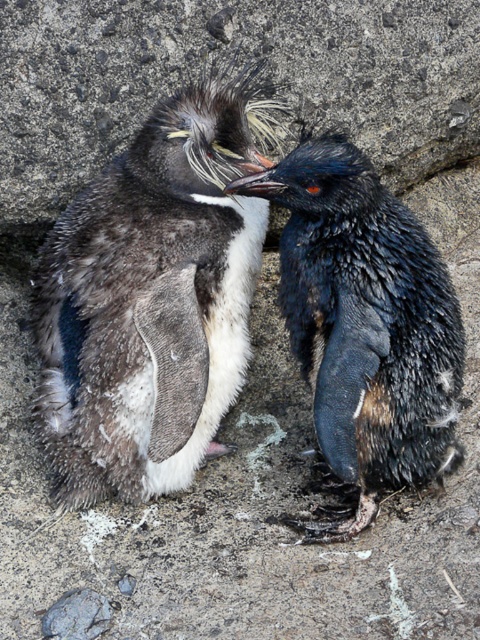
Where is the dark brown fluffy penguin at center located in the image?

The dark brown fluffy penguin at center is located at point (153, 298).

You are a zookeeper who needs to prepare food portions for the dark brown fluffy penguin at center and the shiny black penguin at right. Since the penguin sizes affect their food requirements, which penguin requires a larger portion?

The dark brown fluffy penguin at center requires a larger portion because it is bigger than the shiny black penguin at right.